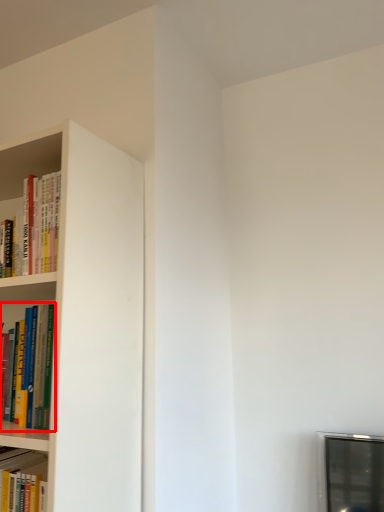
Question: From the image's perspective, what is the correct spatial positioning of book (annotated by the red box) in reference to book?

Choices:
 (A) above
 (B) below

Answer: (B)